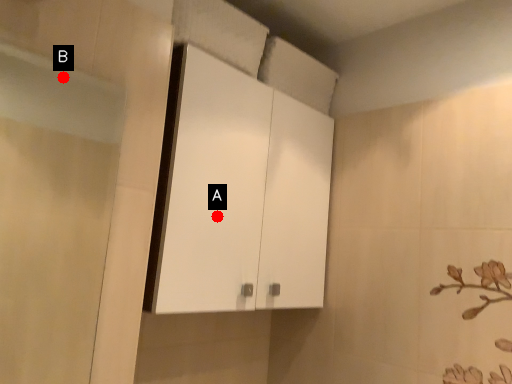
Question: Two points are circled on the image, labeled by A and B beside each circle. Which point is closer to the camera taking this photo?

Choices:
 (A) A is closer
 (B) B is closer

Answer: (A)